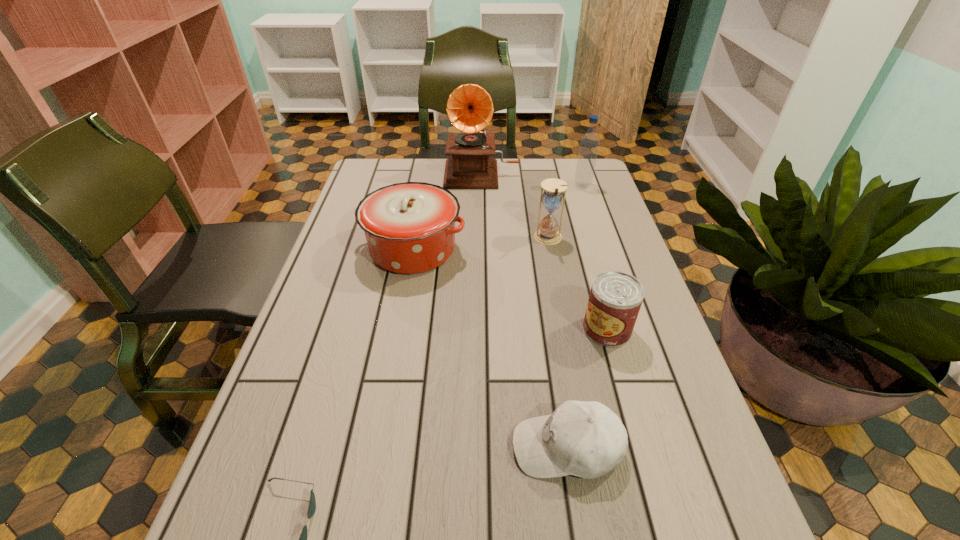
Identify the location of baseball cap that is at the right edge. The width and height of the screenshot is (960, 540). (586, 439).

At what (x,y) coordinates should I click in order to perform the action: click on object that is at the far right corner. Please return your answer as a coordinate pair (x, y). Looking at the image, I should click on (589, 143).

Find the location of a particular element. This screenshot has height=540, width=960. vacant area at the far edge of the desktop is located at coordinates (523, 185).

In the image, there is a desktop. Identify the location of free region at the left edge. This screenshot has height=540, width=960. (340, 235).

What are the coordinates of `free spot at the right edge of the desktop` in the screenshot? It's located at (628, 258).

The height and width of the screenshot is (540, 960). I want to click on vacant space at the far left corner of the desktop, so click(402, 163).

What are the coordinates of `vacant area that lies between the casserole and the hourglass` in the screenshot? It's located at (481, 244).

Locate an element on the screen. Image resolution: width=960 pixels, height=540 pixels. vacant area between the water bottle and the third shortest object is located at coordinates (594, 258).

You are a GUI agent. You are given a task and a screenshot of the screen. Output one action in this format:
    pyautogui.click(x=<x>, y=<y>)
    Task: Click on the free space between the hourglass and the can
    The image size is (960, 540).
    Given the screenshot: What is the action you would take?
    pyautogui.click(x=578, y=284)

Locate an element on the screen. Image resolution: width=960 pixels, height=540 pixels. free space between the casserole and the hourglass is located at coordinates (481, 244).